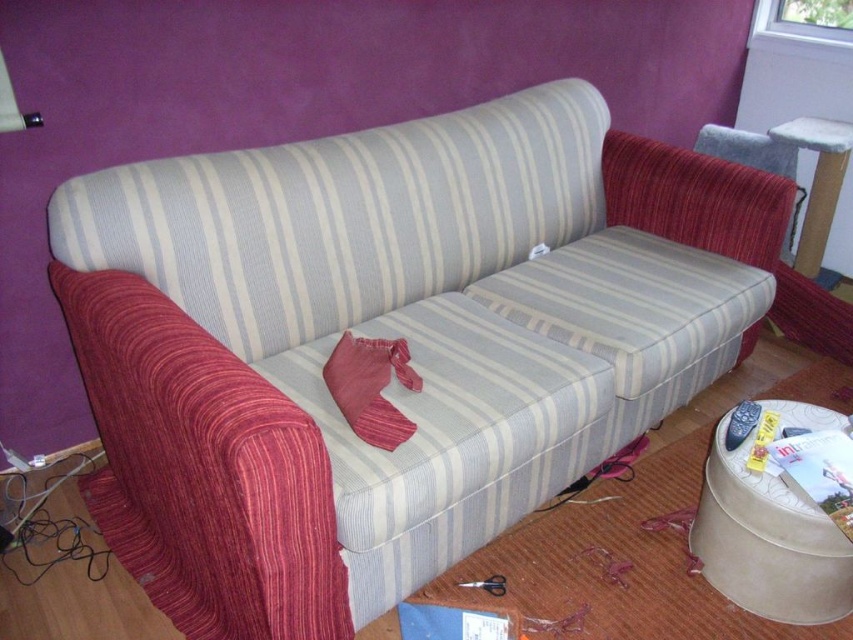
Is point (351, 340) positioned after point (811, 186)?

No, (351, 340) is closer to viewer.

Who is taller, velvet-like red pillow at center or white textured stool at upper right?

With more height is white textured stool at upper right.

This screenshot has width=853, height=640. In order to click on velvet-like red pillow at center in this screenshot , I will do `click(370, 387)`.